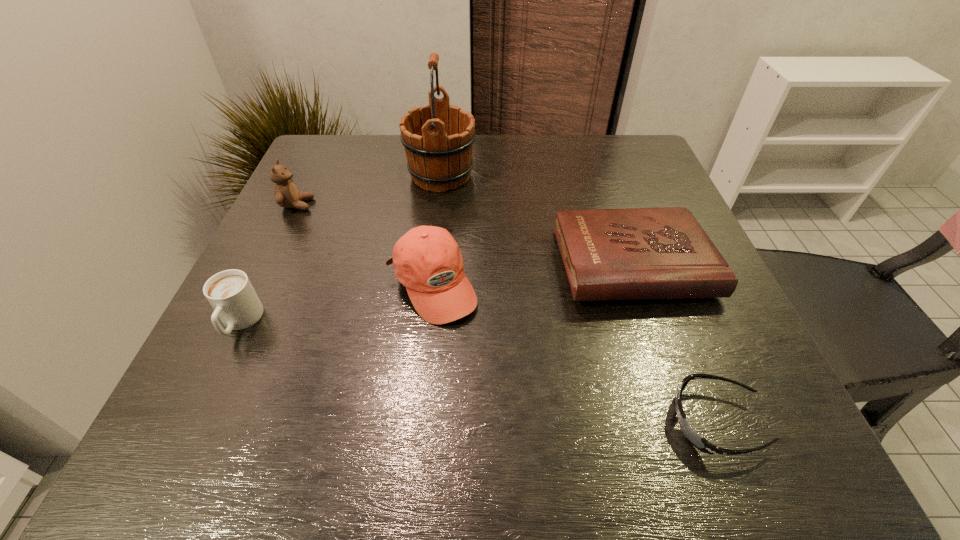
This screenshot has width=960, height=540. Identify the location of sunglasses that is positioned at the right edge. (692, 436).

This screenshot has width=960, height=540. Identify the location of object at the near right corner. (692, 436).

This screenshot has height=540, width=960. I want to click on free space at the far edge of the desktop, so click(x=514, y=150).

The width and height of the screenshot is (960, 540). I want to click on vacant region at the near edge, so click(302, 471).

Image resolution: width=960 pixels, height=540 pixels. In the image, there is a desktop. In order to click on free space at the left edge in this screenshot , I will do `click(291, 237)`.

Identify the location of free region at the right edge. (723, 316).

Where is `vacant space at the far left corner`? The height and width of the screenshot is (540, 960). vacant space at the far left corner is located at coordinates (355, 179).

In the image, there is a desktop. Identify the location of vacant space at the near left corner. Image resolution: width=960 pixels, height=540 pixels. (266, 455).

Where is `vacant area at the far right corner`? vacant area at the far right corner is located at coordinates (644, 166).

In the image, there is a desktop. At what (x,y) coordinates should I click in order to perform the action: click on vacant area at the near right corner. Please return your answer as a coordinate pair (x, y). Looking at the image, I should click on (751, 455).